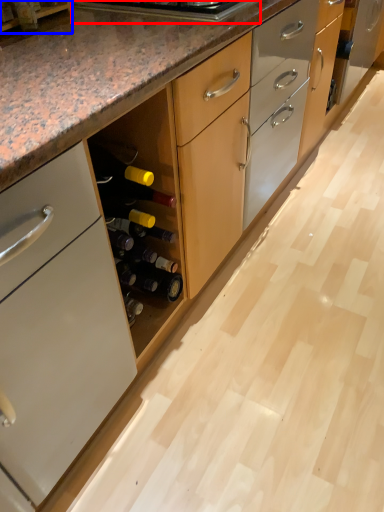
Question: Which object appears closest to the camera in this image, appliance (highlighted by a red box) or shelf (highlighted by a blue box)?

Choices:
 (A) appliance
 (B) shelf

Answer: (B)